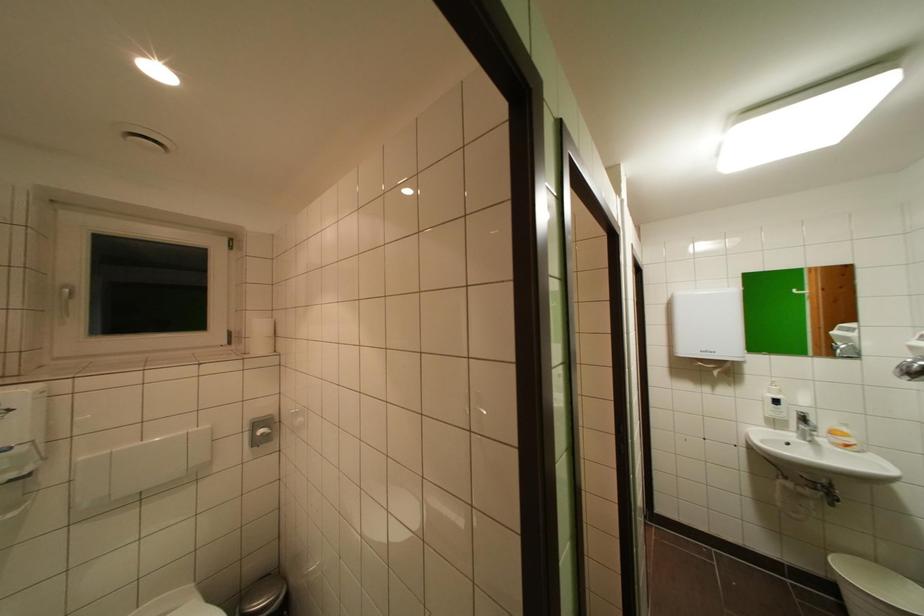
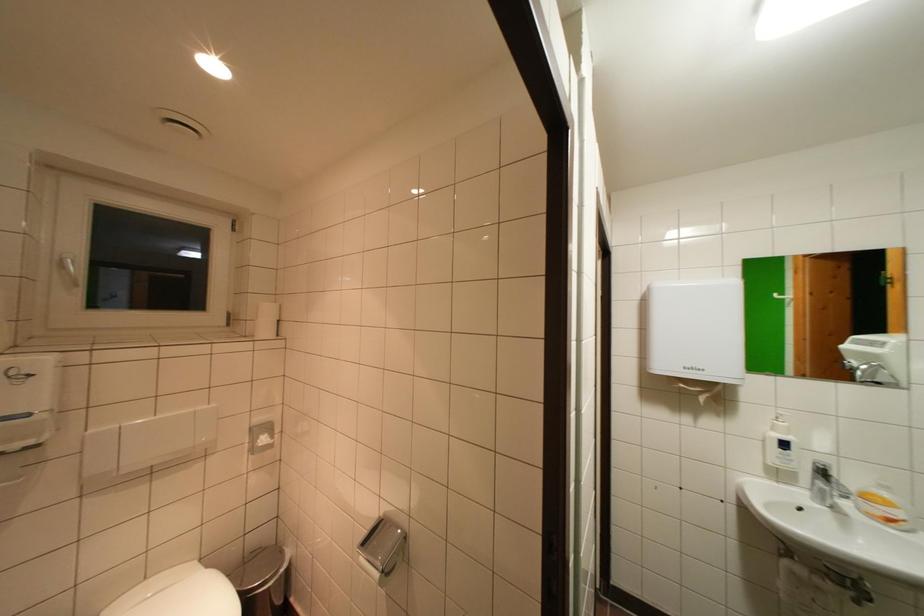
Question: The camera is either moving clockwise (left) or counter-clockwise (right) around the object. The first image is from the beginning of the video and the second image is from the end. Is the camera moving left or right when shooting the video?

Choices:
 (A) Left
 (B) Right

Answer: (A)